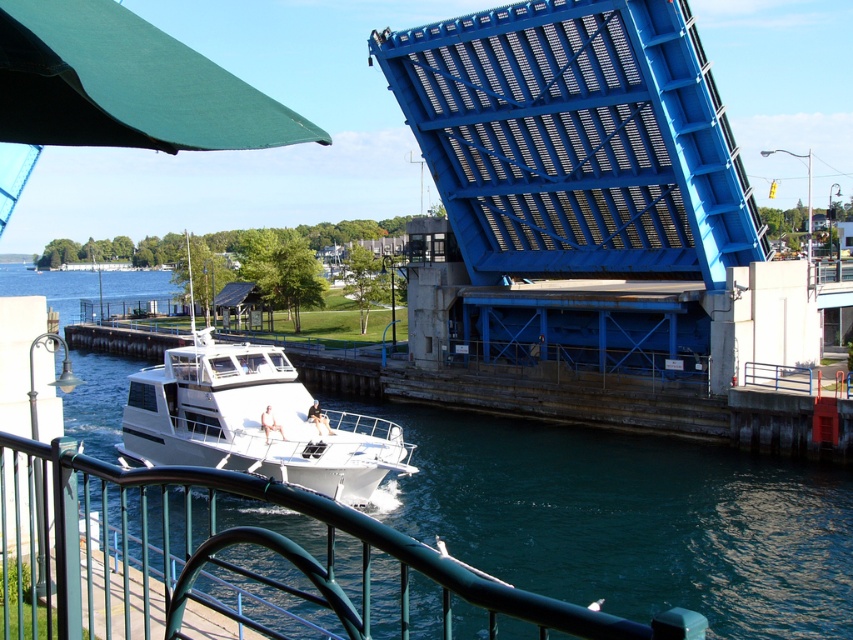
Question: Can you confirm if metallic green railing at lower center is positioned to the left of white glossy boat at center?

Choices:
 (A) yes
 (B) no

Answer: (B)

Question: Which point appears farthest from the camera in this image?

Choices:
 (A) (323, 515)
 (B) (148, 424)
 (C) (412, 486)

Answer: (C)

Question: Considering the relative positions of blue metallic water at lower center and metallic green railing at lower center in the image provided, where is blue metallic water at lower center located with respect to metallic green railing at lower center?

Choices:
 (A) right
 (B) left

Answer: (B)

Question: Which point appears farthest from the camera in this image?

Choices:
 (A) (198, 339)
 (B) (817, 588)
 (C) (1, 534)

Answer: (A)

Question: Which point is closer to the camera taking this photo?

Choices:
 (A) (693, 582)
 (B) (38, 560)

Answer: (B)

Question: Is blue metallic water at lower center further to the viewer compared to metallic green railing at lower center?

Choices:
 (A) yes
 (B) no

Answer: (A)